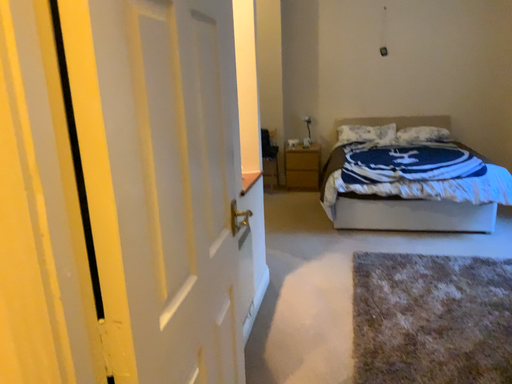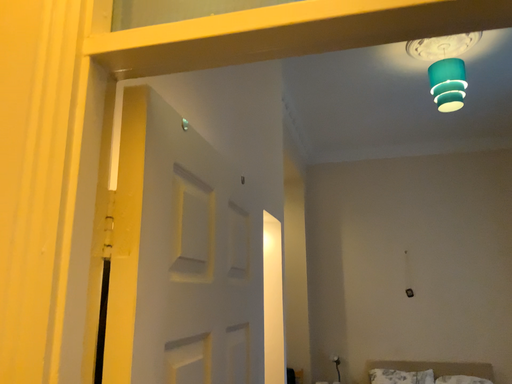
Question: Which way did the camera rotate in the video?

Choices:
 (A) rotated upward
 (B) rotated downward

Answer: (A)